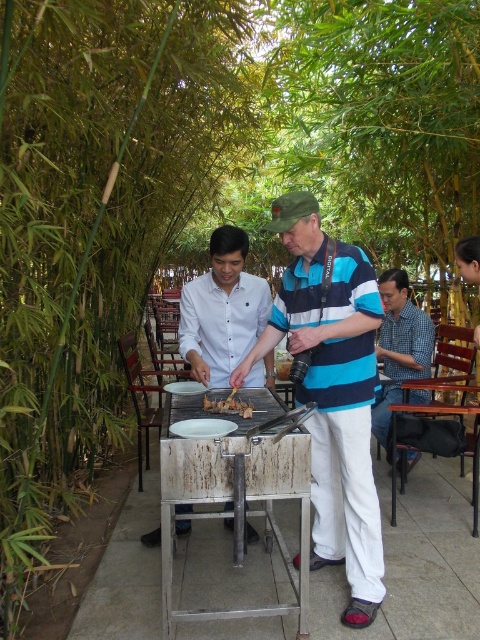
Question: Can you confirm if striped cotton shirt at center is positioned to the right of blue checkered shirt at right?

Choices:
 (A) no
 (B) yes

Answer: (A)

Question: Does blue checkered shirt at right have a smaller size compared to golden crispy chicken at center?

Choices:
 (A) no
 (B) yes

Answer: (A)

Question: Is striped cotton shirt at center bigger than golden crispy chicken at center?

Choices:
 (A) no
 (B) yes

Answer: (B)

Question: Which object is the closest to the white matte shirt at center?

Choices:
 (A) striped cotton shirt at center
 (B) blue checkered shirt at right
 (C) golden crispy chicken at center

Answer: (C)

Question: Among these points, which one is farthest from the camera?

Choices:
 (A) (422, 368)
 (B) (222, 244)
 (C) (229, 404)
 (D) (300, 276)

Answer: (A)

Question: Which object is closer to the camera taking this photo?

Choices:
 (A) golden crispy chicken at center
 (B) blue checkered shirt at right
 (C) white matte shirt at center

Answer: (A)